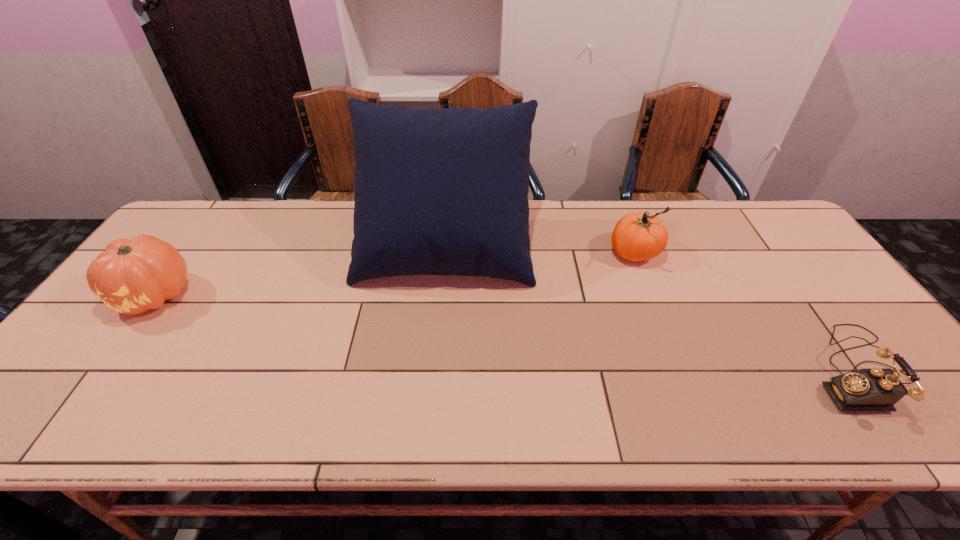
Locate an element on the screen. This screenshot has width=960, height=540. the tallest object is located at coordinates (440, 191).

Identify the location of the third object from right to left. This screenshot has height=540, width=960. (440, 191).

Find the location of a particular element. the second object from right to left is located at coordinates (637, 236).

This screenshot has height=540, width=960. I want to click on the second tallest object, so click(637, 236).

This screenshot has width=960, height=540. What are the coordinates of `the left pumpkin` in the screenshot? It's located at (133, 276).

You are a GUI agent. You are given a task and a screenshot of the screen. Output one action in this format:
    pyautogui.click(x=<x>, y=<y>)
    Task: Click on the third tallest object
    The height and width of the screenshot is (540, 960).
    Given the screenshot: What is the action you would take?
    pyautogui.click(x=133, y=276)

At what (x,y) coordinates should I click in order to perform the action: click on the rightmost object. Please return your answer as a coordinate pair (x, y). Looking at the image, I should click on (875, 389).

Find the location of `telephone`. telephone is located at coordinates (875, 389).

Locate an element on the screen. Image resolution: width=960 pixels, height=540 pixels. vacant space located 0.390m on the facing side of the third object from right to left is located at coordinates pos(430,422).

Identify the location of free location located 0.270m on the front of the third shortest object. (672, 349).